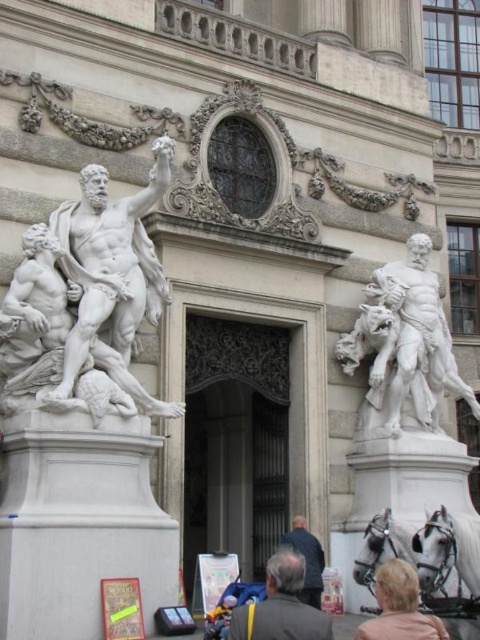
Which is above, metallic silver coach at lower center or metallic silver coach at center?

metallic silver coach at center is above.

Is metallic silver coach at lower center shorter than metallic silver coach at center?

Incorrect, metallic silver coach at lower center's height does not fall short of metallic silver coach at center's.

Which is behind, point (272, 589) or point (307, 600)?

Point (307, 600)

Locate an element on the screen. This screenshot has width=480, height=640. metallic silver coach at lower center is located at coordinates (280, 605).

Consider the image. Who is more forward, (156,404) or (307,536)?

Point (156,404)

Does white marble statue at left have a lesser height compared to metallic silver coach at center?

Incorrect, white marble statue at left's height does not fall short of metallic silver coach at center's.

Where is `white marble statue at left`? white marble statue at left is located at coordinates (94, 291).

Measure the distance between white marble statue at left and camera.

white marble statue at left and camera are 108.54 feet apart.

Between point (164, 179) and point (374, 544), which one is positioned behind?

The point (374, 544) is behind.

Between point (127, 280) and point (451, 605), which one is positioned in front?

Point (127, 280) is more forward.

I want to click on white marble statue at left, so click(x=94, y=291).